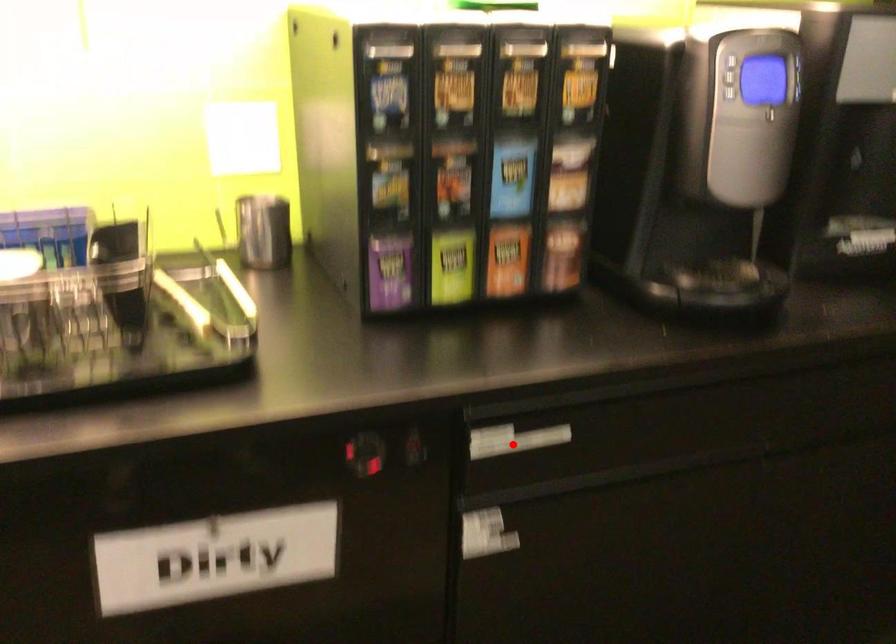
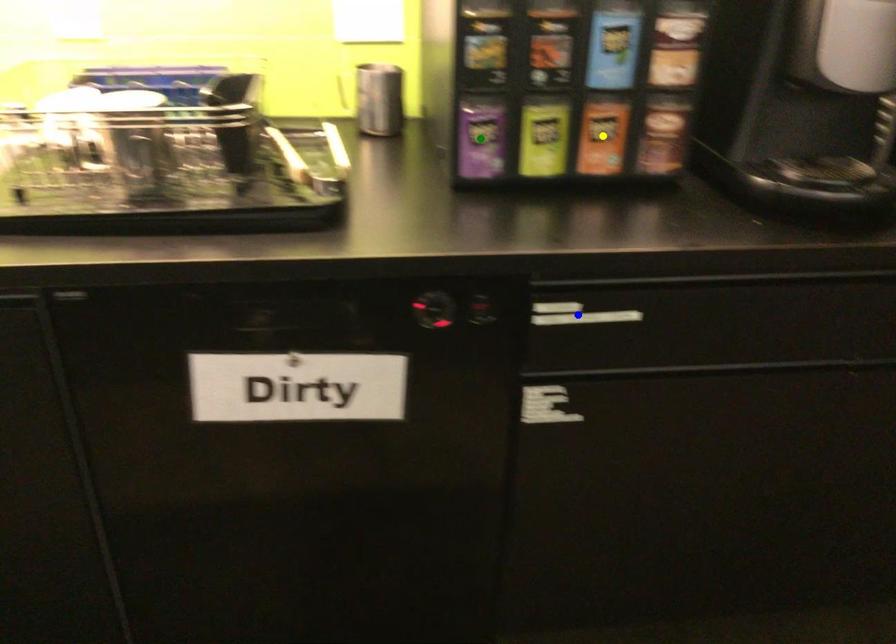
Question: I am providing you with two images of the same scene from different viewpoints. A red point is marked on the first image. You are given multiple points on the second image. Can you choose the point in image 2 that corresponds to the point in image 1?

Choices:
 (A) green point
 (B) yellow point
 (C) blue point

Answer: (C)